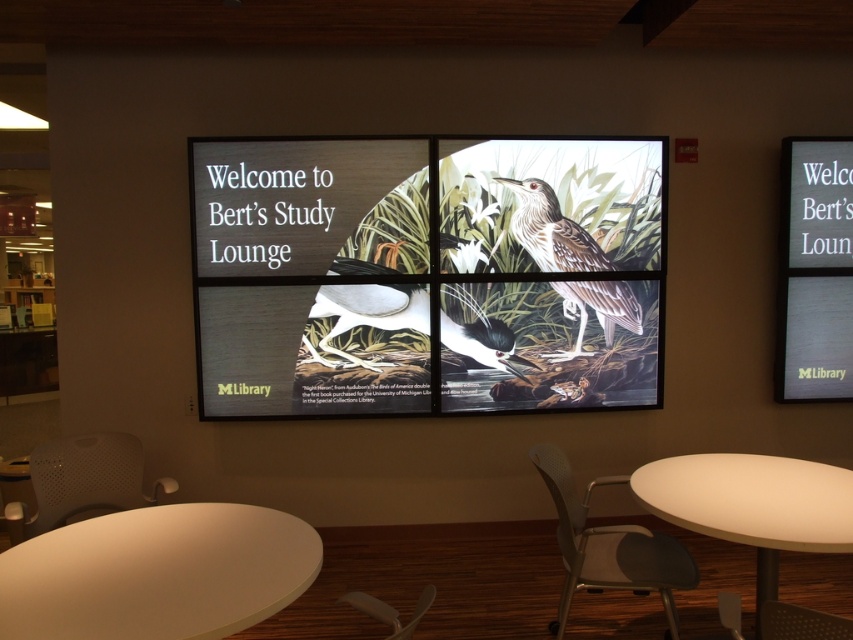
You are standing in the library and see the digital display with four sections. You need to place a small potted plant on the white matte table at lower right. According to the coordinates provided, is the point marked as point (752, 504) the correct location for the table?

Yes, the point (752, 504) marks the white matte table at lower right, so placing the potted plant there would be correct.

You are a visitor in the library and want to choose a chair that is taller. Which one should you pick between the gray plastic chair at lower center and the white perforated plastic chair at lower left?

The gray plastic chair at lower center is taller than the white perforated plastic chair at lower left, so you should pick the gray plastic chair at lower center.

You are sitting at a table in the library and notice two birds displayed at the center of the digital display. Which one is closer to you, the white glossy bird at center or the white paper bird at center?

The white glossy bird at center is closer to you because it is in front of the white paper bird at center.